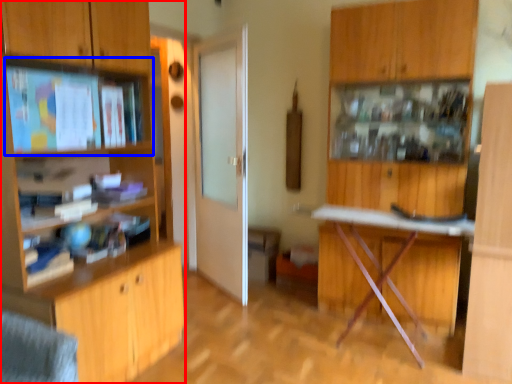
Question: Which of the following is the farthest to the observer, cabinetry (highlighted by a red box) or shelf (highlighted by a blue box)?

Choices:
 (A) cabinetry
 (B) shelf

Answer: (B)